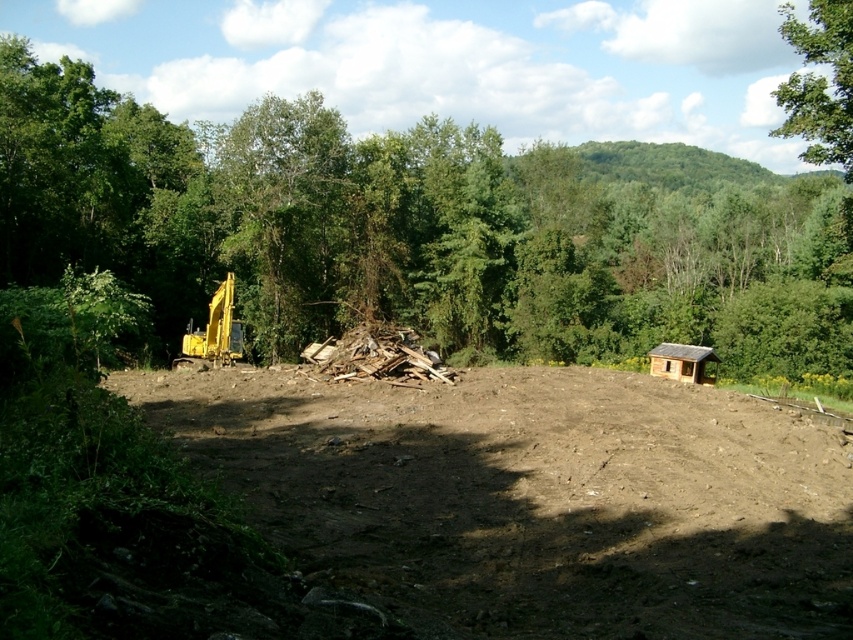
Can you confirm if brown dirt field at center is shorter than yellow rubber excavator at left?

Correct, brown dirt field at center is not as tall as yellow rubber excavator at left.

Is brown dirt field at center positioned before yellow rubber excavator at left?

That is True.

This screenshot has width=853, height=640. Find the location of `brown dirt field at center`. brown dirt field at center is located at coordinates (532, 497).

Where is `brown dirt field at center`? Image resolution: width=853 pixels, height=640 pixels. brown dirt field at center is located at coordinates (532, 497).

Which is below, brown dirt field at center or green leafy tree at upper right?

brown dirt field at center is below.

Does brown dirt field at center have a lesser height compared to green leafy tree at upper right?

Yes, brown dirt field at center is shorter than green leafy tree at upper right.

Locate an element on the screen. Image resolution: width=853 pixels, height=640 pixels. brown dirt field at center is located at coordinates (x=532, y=497).

I want to click on brown dirt field at center, so click(x=532, y=497).

Does green leafy tree at center have a larger size compared to brown dirt field at center?

Yes, green leafy tree at center is bigger than brown dirt field at center.

Can you confirm if green leafy tree at center is shorter than brown dirt field at center?

No, green leafy tree at center is not shorter than brown dirt field at center.

This screenshot has width=853, height=640. What do you see at coordinates (403, 230) in the screenshot?
I see `green leafy tree at center` at bounding box center [403, 230].

You are a GUI agent. You are given a task and a screenshot of the screen. Output one action in this format:
    pyautogui.click(x=<x>, y=<y>)
    Task: Click on the green leafy tree at center
    Image resolution: width=853 pixels, height=640 pixels.
    Given the screenshot: What is the action you would take?
    pyautogui.click(x=403, y=230)